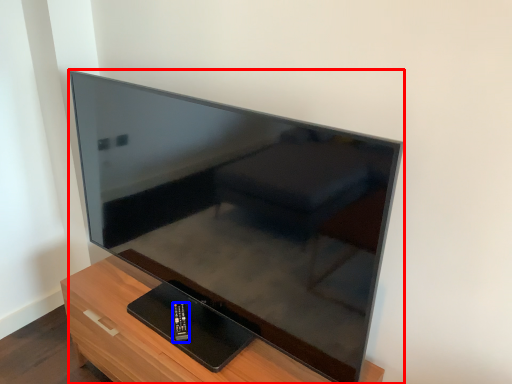
Question: Which object is closer to the camera taking this photo, television (highlighted by a red box) or control (highlighted by a blue box)?

Choices:
 (A) television
 (B) control

Answer: (A)